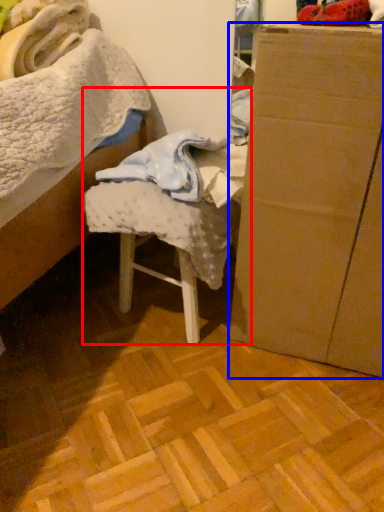
Question: Which point is closer to the camera, chair (highlighted by a red box) or furniture (highlighted by a blue box)?

Choices:
 (A) chair
 (B) furniture

Answer: (B)